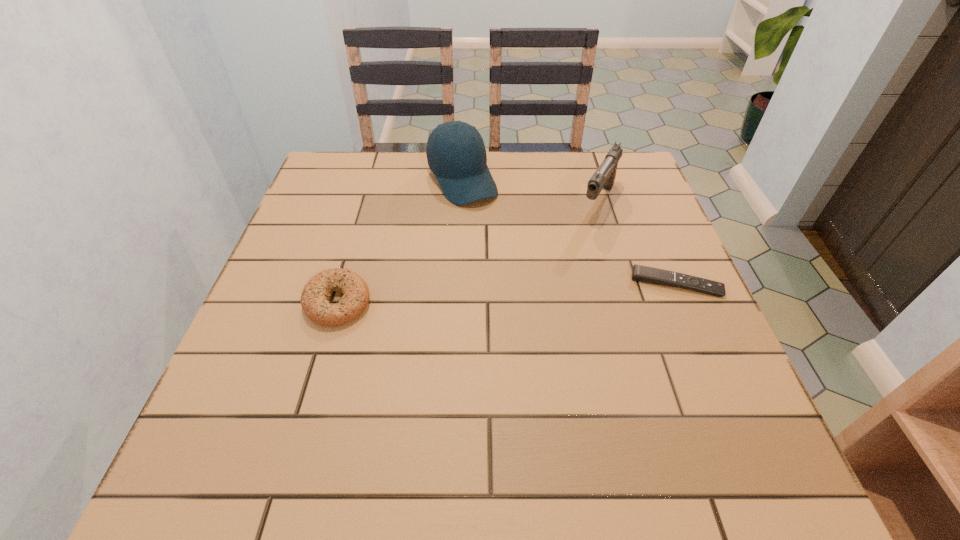
The height and width of the screenshot is (540, 960). I want to click on vacant space that is in between the gun and the second shortest object, so 468,252.

Image resolution: width=960 pixels, height=540 pixels. What are the coordinates of `vacant region between the bagel and the gun` in the screenshot? It's located at (468, 252).

I want to click on free spot between the gun and the third object from right to left, so click(530, 191).

In order to click on unoccupied area between the third object from right to left and the gun in this screenshot , I will do `click(530, 191)`.

At what (x,y) coordinates should I click in order to perform the action: click on unoccupied position between the shortest object and the baseball cap. Please return your answer as a coordinate pair (x, y). This screenshot has width=960, height=540. Looking at the image, I should click on (569, 232).

Find the location of `free spot between the remote control and the second object from left to right`. free spot between the remote control and the second object from left to right is located at coordinates (569, 232).

Where is `the second closest object to the gun`? This screenshot has height=540, width=960. the second closest object to the gun is located at coordinates (456, 154).

You are a GUI agent. You are given a task and a screenshot of the screen. Output one action in this format:
    pyautogui.click(x=<x>, y=<y>)
    Task: Click on the third closest object to the baseball cap
    This screenshot has width=960, height=540.
    Given the screenshot: What is the action you would take?
    pyautogui.click(x=640, y=273)

In order to click on vacant space that satisfies the following two spatial constraints: 1. on the back side of the leftmost object; 2. on the right side of the baseball cap in this screenshot , I will do `click(373, 180)`.

Locate an element on the screen. The image size is (960, 540). blank space that satisfies the following two spatial constraints: 1. on the front side of the baseball cap; 2. on the left side of the shortest object is located at coordinates (457, 284).